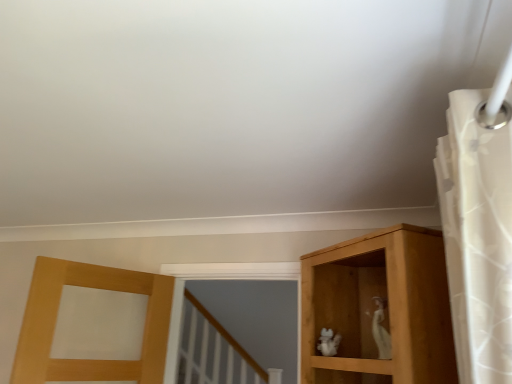
Question: Is white sheer fabric at upper right at the left side of white porcelain cat at center-right?

Choices:
 (A) yes
 (B) no

Answer: (B)

Question: Considering the relative sizes of white sheer fabric at upper right and white porcelain cat at center-right in the image provided, is white sheer fabric at upper right smaller than white porcelain cat at center-right?

Choices:
 (A) yes
 (B) no

Answer: (B)

Question: Can white porcelain cat at center-right be found inside white sheer fabric at upper right?

Choices:
 (A) yes
 (B) no

Answer: (B)

Question: Does white sheer fabric at upper right have a greater width compared to white porcelain cat at center-right?

Choices:
 (A) no
 (B) yes

Answer: (B)

Question: Does white sheer fabric at upper right appear on the right side of white porcelain cat at center-right?

Choices:
 (A) no
 (B) yes

Answer: (B)

Question: Does white sheer fabric at upper right come in front of white porcelain cat at center-right?

Choices:
 (A) no
 (B) yes

Answer: (B)

Question: Is white porcelain cat at center-right further to camera compared to white sheer fabric at upper right?

Choices:
 (A) no
 (B) yes

Answer: (B)

Question: Is white porcelain cat at center-right to the left of white sheer fabric at upper right from the viewer's perspective?

Choices:
 (A) yes
 (B) no

Answer: (A)

Question: Are white porcelain cat at center-right and white sheer fabric at upper right far apart?

Choices:
 (A) no
 (B) yes

Answer: (A)

Question: Considering the relative sizes of white porcelain cat at center-right and white sheer fabric at upper right in the image provided, is white porcelain cat at center-right taller than white sheer fabric at upper right?

Choices:
 (A) yes
 (B) no

Answer: (B)

Question: Is white porcelain cat at center-right surrounding white sheer fabric at upper right?

Choices:
 (A) yes
 (B) no

Answer: (B)

Question: From a real-world perspective, is white porcelain cat at center-right over white sheer fabric at upper right?

Choices:
 (A) no
 (B) yes

Answer: (A)

Question: From the image's perspective, is white sheer fabric at upper right above or below white porcelain cat at center-right?

Choices:
 (A) above
 (B) below

Answer: (A)